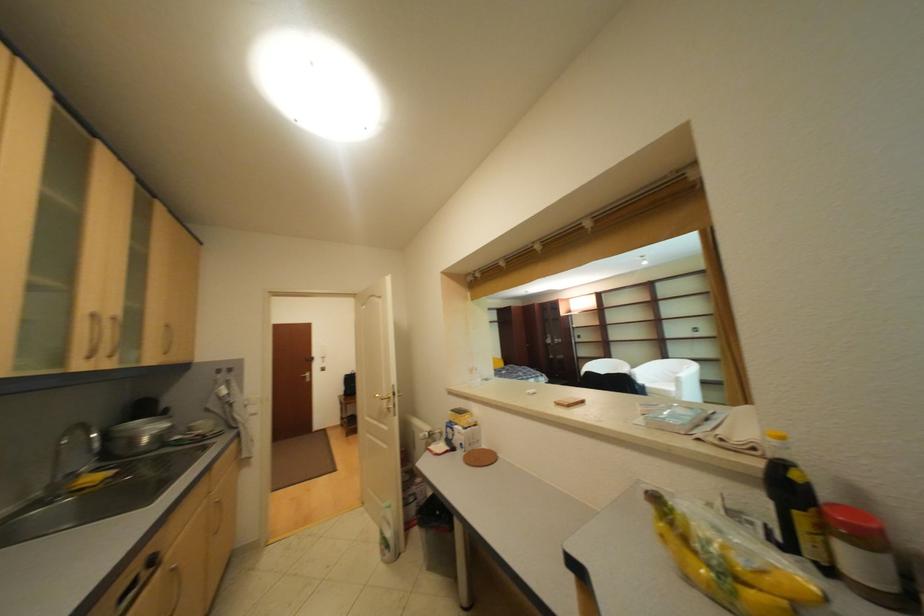
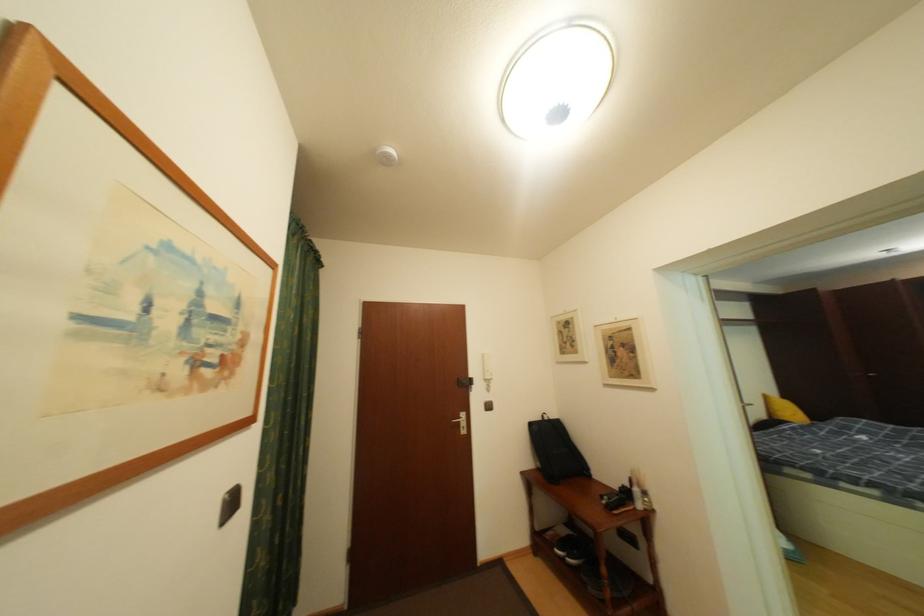
The images are taken continuously from a first-person perspective. In which direction are you moving?

The cameraman walked toward left, forward.